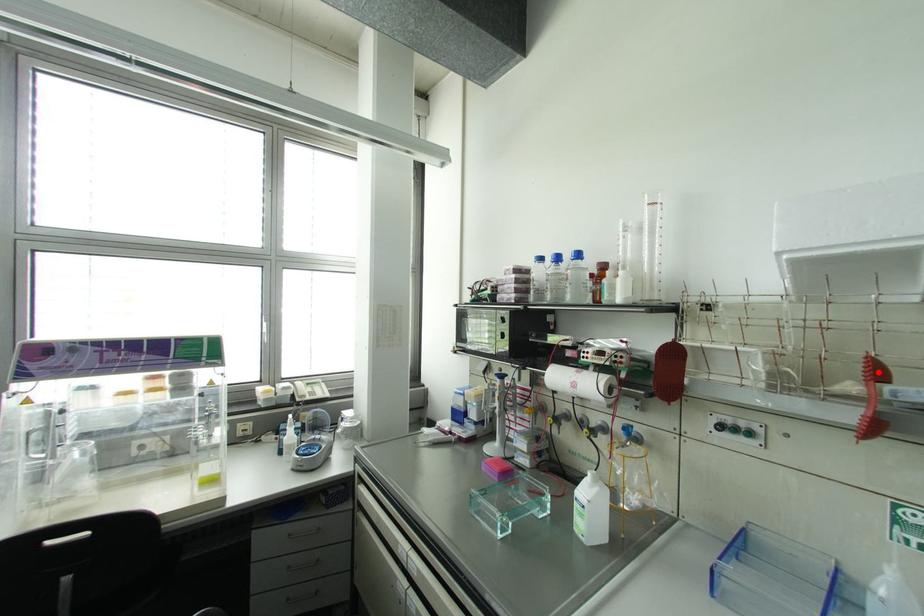
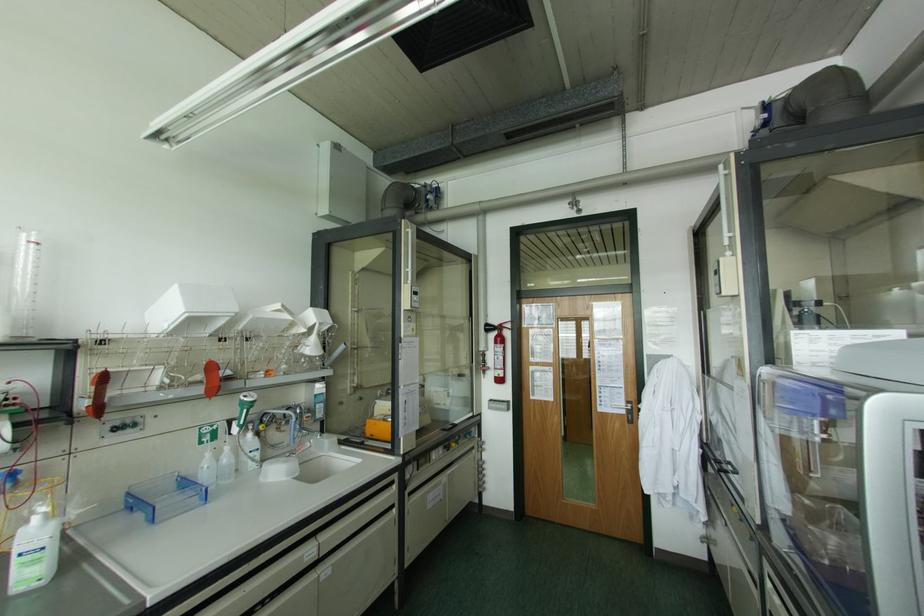
Find the pixel in the second image that matches the highlighted location in the first image.

(211, 368)